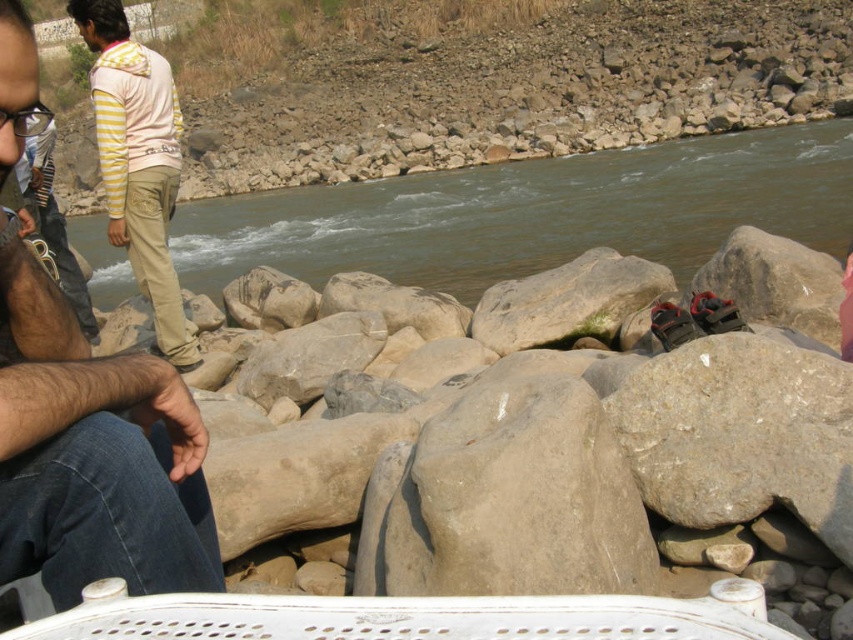
You are trying to locate the beige cotton pants at center in the riverside scene. According to the image, where is it positioned relative to the light pink hoodie at upper left?

The beige cotton pants at center is positioned below the light pink hoodie at upper left.